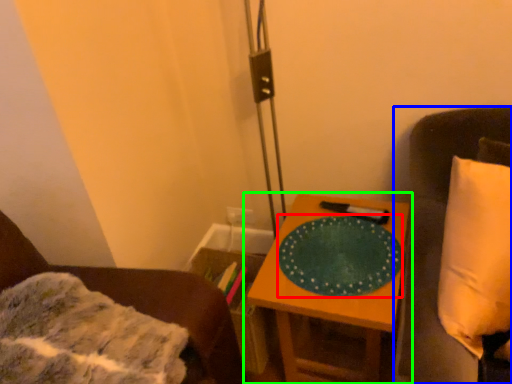
Question: Which is nearer to the platter (highlighted by a red box)? furniture (highlighted by a blue box) or table (highlighted by a green box).

Choices:
 (A) furniture
 (B) table

Answer: (B)